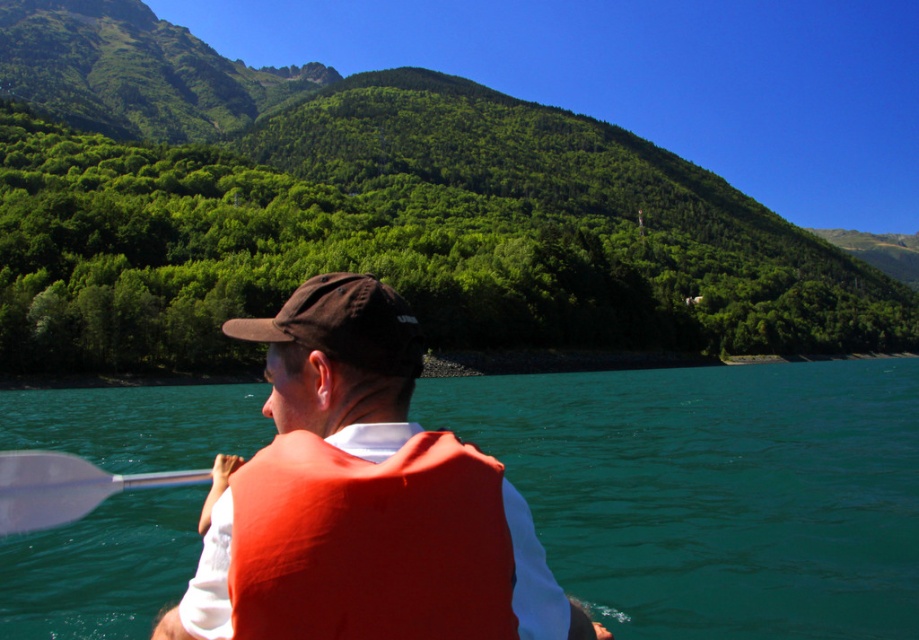
Question: Is brown fabric baseball cap at center to the right of white plastic paddle at lower left from the viewer's perspective?

Choices:
 (A) no
 (B) yes

Answer: (A)

Question: Does teal glossy water at center have a larger size compared to orange life vest at center?

Choices:
 (A) no
 (B) yes

Answer: (B)

Question: Which of the following is the farthest from the observer?

Choices:
 (A) white plastic paddle at lower left
 (B) orange fabric life jacket at center
 (C) teal glossy water at center
 (D) brown fabric baseball cap at center

Answer: (A)

Question: Among these points, which one is farthest from the camera?

Choices:
 (A) (354, 296)
 (B) (330, 621)
 (C) (781, 550)
 (D) (491, 545)

Answer: (C)

Question: Is green forested mountain at upper center further to the viewer compared to teal glossy water at center?

Choices:
 (A) yes
 (B) no

Answer: (A)

Question: Which point is closer to the camera?

Choices:
 (A) orange life vest at center
 (B) white plastic paddle at lower left

Answer: (A)